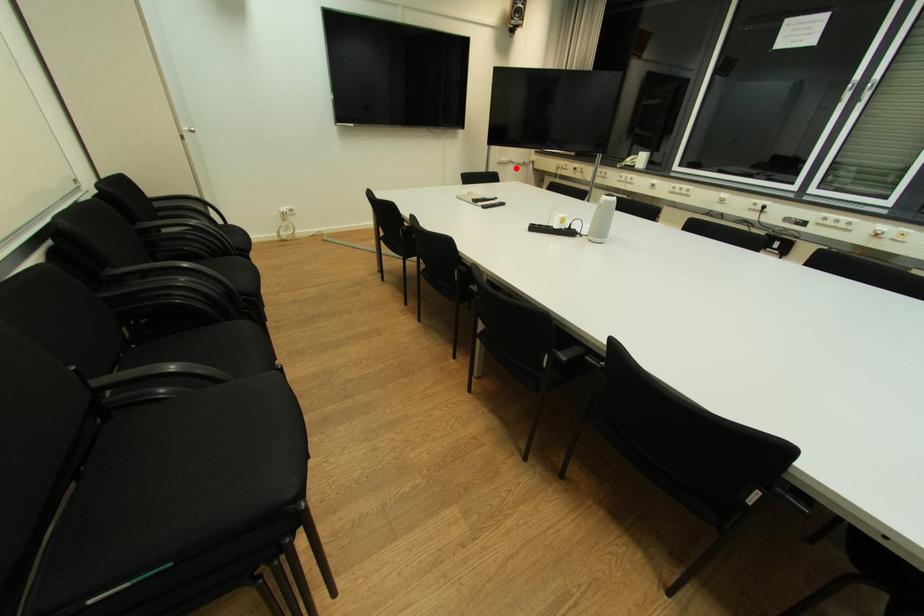
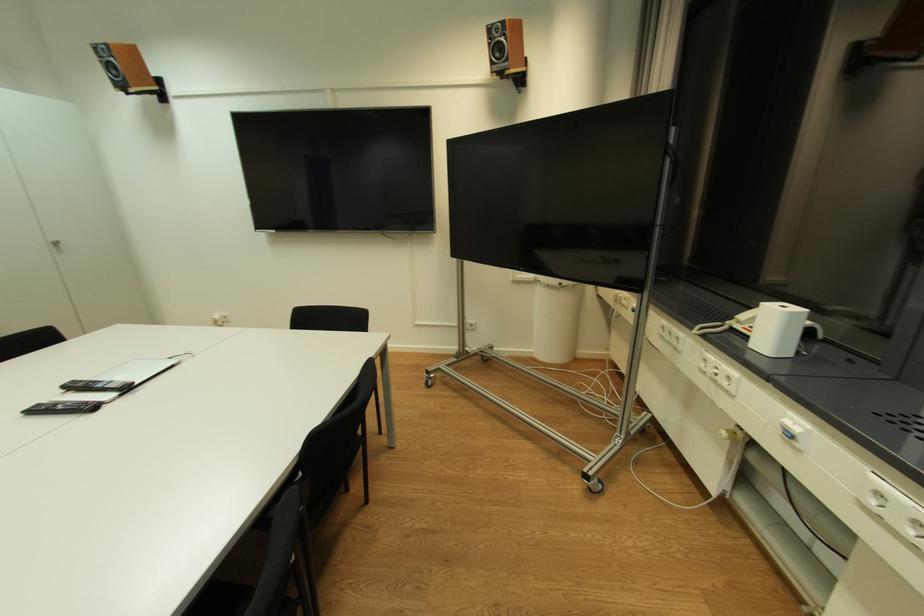
The point at the highlighted location is marked in the first image. Where is the corresponding point in the second image?

(544, 290)